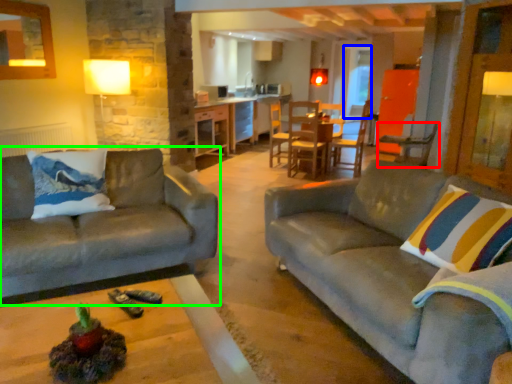
Question: Which object is positioned closest to chair (highlighted by a red box)? Select from glass door (highlighted by a blue box) and studio couch (highlighted by a green box).

Choices:
 (A) glass door
 (B) studio couch

Answer: (A)